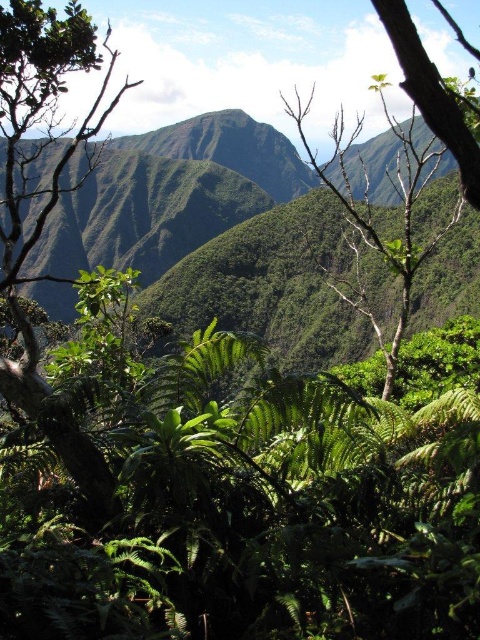
Consider the image. You are a hiker who wants to navigate between the green leafy tree at center and the smooth bark tree at upper right. The path between them is 1 meter wide. Can you walk through the path without any obstacles?

The distance between the green leafy tree at center and the smooth bark tree at upper right is 136.52 meters. Since the path is only 1 meter wide, it is likely too narrow for you to walk through comfortably. You may need to find a wider path or alternative route.

You are a hiker trying to determine the best path through the dense tropical vegetation. You notice two trees ahead of you. The first is the green leafy tree at center, and the second is the smooth bark tree at upper right. Which tree would you need to walk around if you want to take the path that requires less detour?

The green leafy tree at center might be wider than smooth bark tree at upper right, so you would need to walk around the green leafy tree at center to avoid a larger detour.

You are standing in the lush landscape and want to move from the point at coordinates point (379,337) to the point at coordinates point (479,172). Which direction should you move to get closer to your destination?

To move from point (379,337) to point (479,172), you should move upward because point (379,337) is further to the viewer than point (479,172), meaning it is closer to you. Moving upward would take you toward the more distant point.